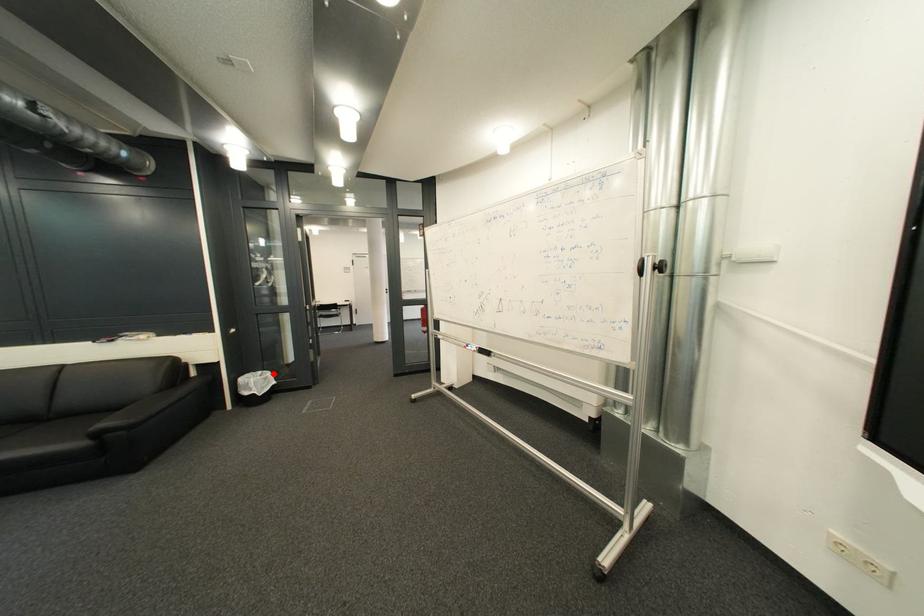
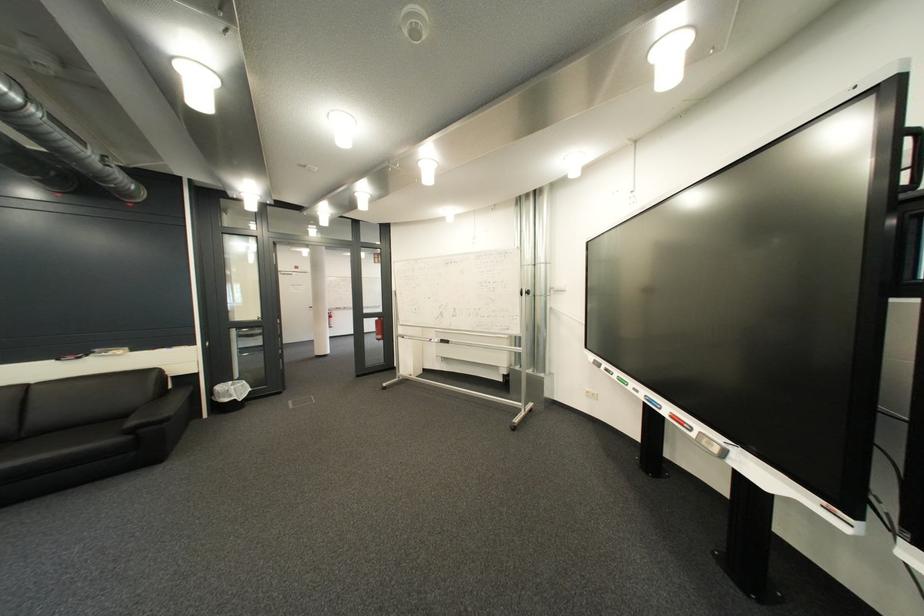
The point at the highlighted location is marked in the first image. Where is the corresponding point in the second image?

(245, 384)